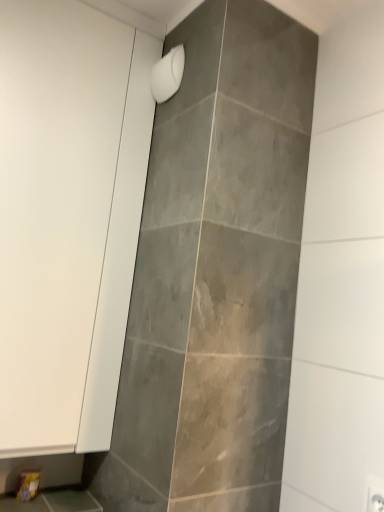
Question: Is white matte shower head at upper center positioned in front of white matte cabinet at left?

Choices:
 (A) yes
 (B) no

Answer: (B)

Question: From a real-world perspective, does white matte shower head at upper center stand above white matte cabinet at left?

Choices:
 (A) no
 (B) yes

Answer: (B)

Question: Considering the relative positions of white matte shower head at upper center and white matte cabinet at left in the image provided, is white matte shower head at upper center to the left of white matte cabinet at left from the viewer's perspective?

Choices:
 (A) yes
 (B) no

Answer: (B)

Question: Considering the relative sizes of white matte shower head at upper center and white matte cabinet at left in the image provided, is white matte shower head at upper center thinner than white matte cabinet at left?

Choices:
 (A) no
 (B) yes

Answer: (B)

Question: Can you confirm if white matte shower head at upper center is smaller than white matte cabinet at left?

Choices:
 (A) yes
 (B) no

Answer: (A)

Question: Considering the relative sizes of white matte shower head at upper center and white matte cabinet at left in the image provided, is white matte shower head at upper center bigger than white matte cabinet at left?

Choices:
 (A) no
 (B) yes

Answer: (A)

Question: Is white matte cabinet at left wider than white matte shower head at upper center?

Choices:
 (A) no
 (B) yes

Answer: (B)

Question: Is white matte cabinet at left shorter than white matte shower head at upper center?

Choices:
 (A) no
 (B) yes

Answer: (A)

Question: From a real-world perspective, is white matte cabinet at left under white matte shower head at upper center?

Choices:
 (A) no
 (B) yes

Answer: (B)

Question: Are white matte cabinet at left and white matte shower head at upper center beside each other?

Choices:
 (A) yes
 (B) no

Answer: (B)

Question: Does white matte cabinet at left turn towards white matte shower head at upper center?

Choices:
 (A) yes
 (B) no

Answer: (A)

Question: Would you say white matte shower head at upper center is part of white matte cabinet at left's contents?

Choices:
 (A) no
 (B) yes

Answer: (A)

Question: From the image's perspective, relative to white matte cabinet at left, is white matte shower head at upper center above or below?

Choices:
 (A) below
 (B) above

Answer: (B)